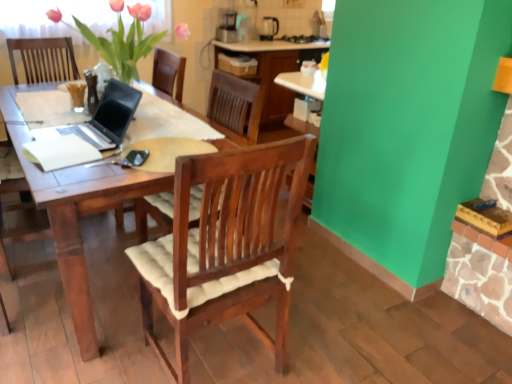
Question: Is white paper at center behind matte black coffee maker at upper center?

Choices:
 (A) yes
 (B) no

Answer: (B)

Question: Is white paper at center positioned before matte black coffee maker at upper center?

Choices:
 (A) no
 (B) yes

Answer: (B)

Question: Considering the relative sizes of white paper at center and matte black coffee maker at upper center in the image provided, is white paper at center wider than matte black coffee maker at upper center?

Choices:
 (A) no
 (B) yes

Answer: (B)

Question: Is white paper at center aimed at matte black coffee maker at upper center?

Choices:
 (A) yes
 (B) no

Answer: (B)

Question: Is white paper at center not near matte black coffee maker at upper center?

Choices:
 (A) no
 (B) yes

Answer: (B)

Question: Is white paper at center bigger than matte black coffee maker at upper center?

Choices:
 (A) no
 (B) yes

Answer: (A)

Question: Considering the relative sizes of wooden laptop at left and pink matte vase at upper left in the image provided, is wooden laptop at left smaller than pink matte vase at upper left?

Choices:
 (A) yes
 (B) no

Answer: (B)

Question: From a real-world perspective, is wooden laptop at left physically above pink matte vase at upper left?

Choices:
 (A) no
 (B) yes

Answer: (A)

Question: Is wooden laptop at left in front of pink matte vase at upper left?

Choices:
 (A) no
 (B) yes

Answer: (A)

Question: Is wooden laptop at left thinner than pink matte vase at upper left?

Choices:
 (A) no
 (B) yes

Answer: (B)

Question: Does wooden laptop at left have a lesser height compared to pink matte vase at upper left?

Choices:
 (A) no
 (B) yes

Answer: (A)

Question: From the image's perspective, is wooden laptop at left on pink matte vase at upper left?

Choices:
 (A) no
 (B) yes

Answer: (A)

Question: From the image's perspective, is matte black coffee maker at upper center located above pink matte vase at upper left?

Choices:
 (A) no
 (B) yes

Answer: (B)